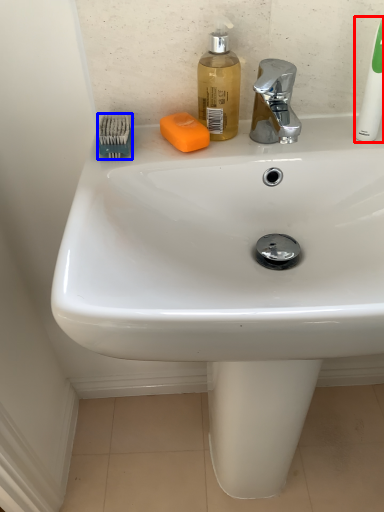
Question: Which object is closer to the camera taking this photo, toothbrush (highlighted by a red box) or brush (highlighted by a blue box)?

Choices:
 (A) toothbrush
 (B) brush

Answer: (A)